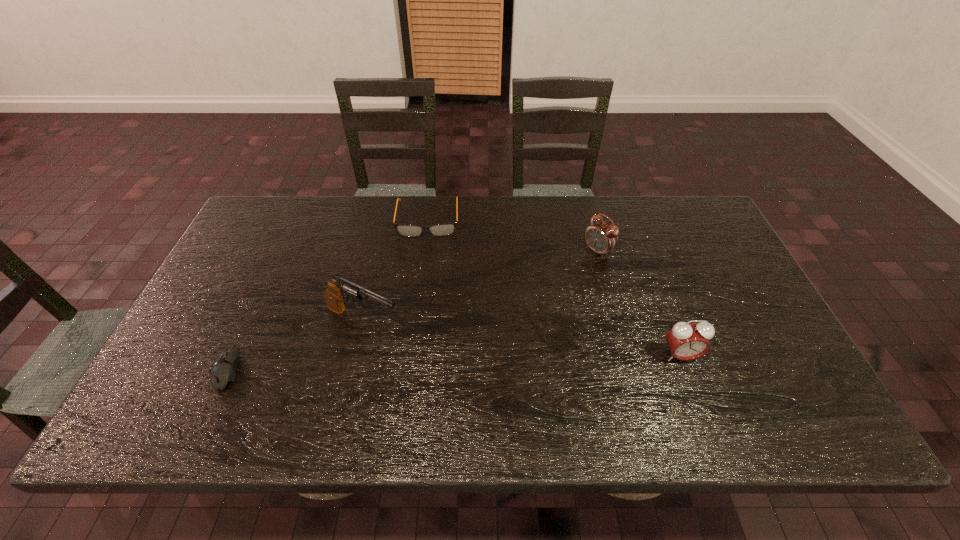
This screenshot has width=960, height=540. I want to click on free space between the farthest object and the third nearest object, so click(x=396, y=269).

I want to click on free space between the gun and the farther alarm clock, so click(480, 286).

Where is `object that is the second closest to the fourth tallest object`? This screenshot has width=960, height=540. object that is the second closest to the fourth tallest object is located at coordinates (601, 237).

Identify which object is the fourth closest to the second farthest object. Please provide its 2D coordinates. Your answer should be formatted as a tuple, i.e. [(x, y)], where the tuple contains the x and y coordinates of a point satisfying the conditions above.

[(223, 370)]